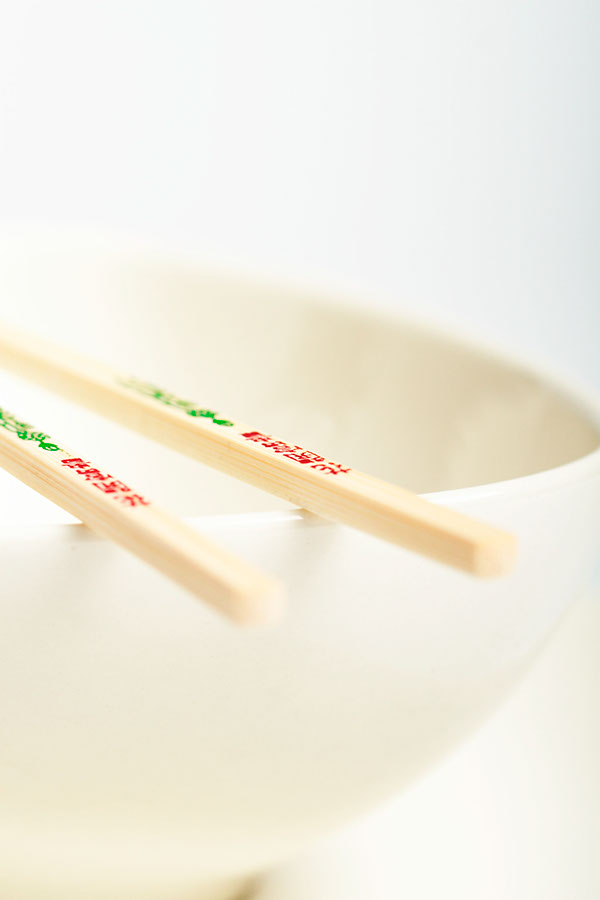
What are the coordinates of `surface under/behind bowl` in the screenshot? It's located at (393, 165).